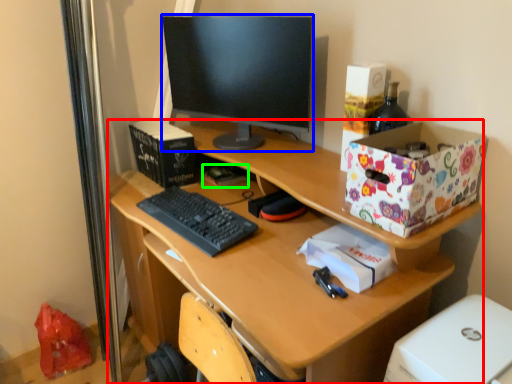
Question: Based on their relative distances, which object is nearer to desk (highlighted by a red box)? Choose from television (highlighted by a blue box) and book (highlighted by a green box).

Choices:
 (A) television
 (B) book

Answer: (A)